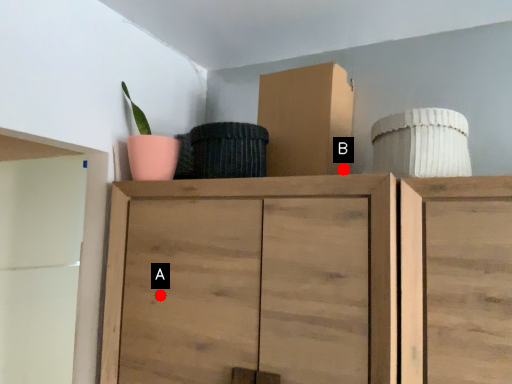
Question: Two points are circled on the image, labeled by A and B beside each circle. Among these points, which one is nearest to the camera?

Choices:
 (A) A is closer
 (B) B is closer

Answer: (A)